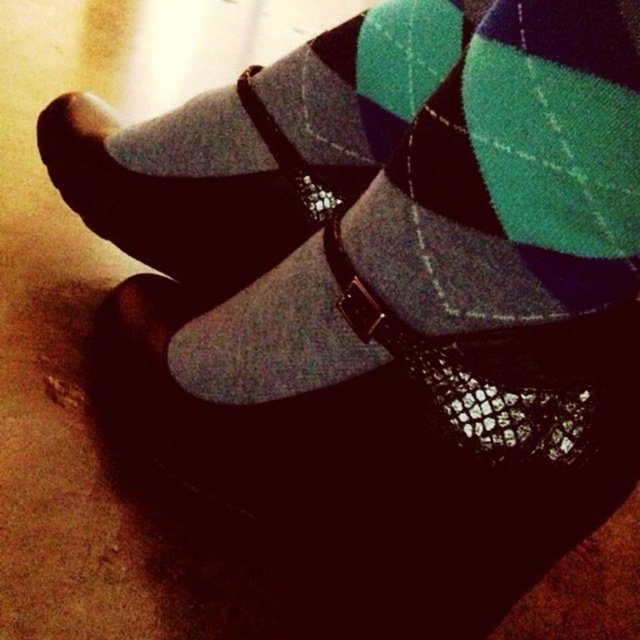
Question: Can you confirm if argyle wool sock at center is wider than matte black socks at center?

Choices:
 (A) yes
 (B) no

Answer: (B)

Question: Does argyle wool sock at center have a greater width compared to matte black socks at center?

Choices:
 (A) yes
 (B) no

Answer: (B)

Question: Which of the following is the closest to the observer?

Choices:
 (A) (301, 138)
 (B) (296, 289)

Answer: (B)

Question: Which of the following is the closest to the observer?

Choices:
 (A) click(188, 179)
 (B) click(570, 272)

Answer: (B)

Question: Can you confirm if argyle wool sock at center is positioned below matte black socks at center?

Choices:
 (A) no
 (B) yes

Answer: (B)

Question: Among these objects, which one is farthest from the camera?

Choices:
 (A) matte black socks at center
 (B) argyle wool sock at center

Answer: (A)